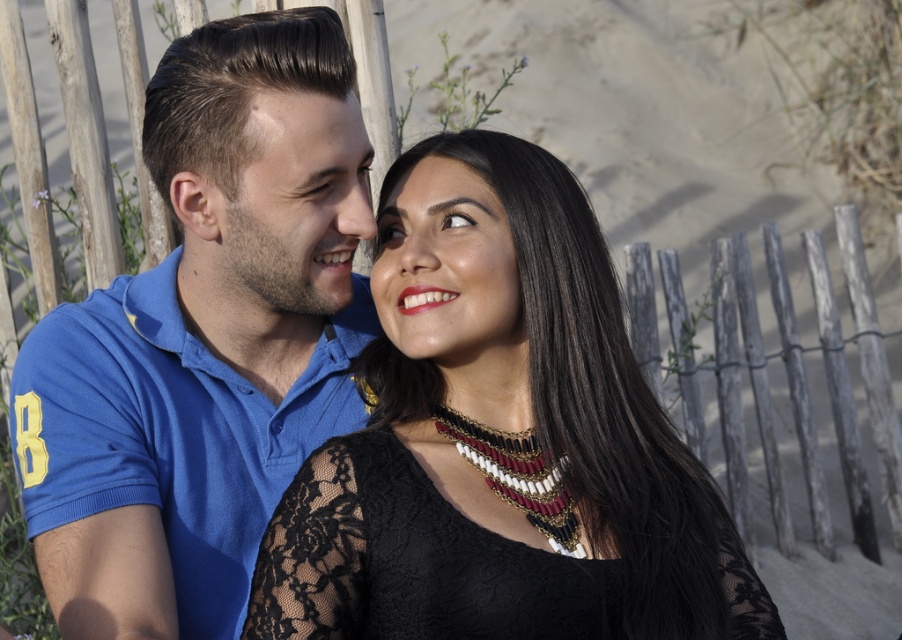
Question: Does black lace dress at center have a greater width compared to smooth skin at upper center?

Choices:
 (A) yes
 (B) no

Answer: (A)

Question: Which of the following is the farthest from the observer?

Choices:
 (A) blue cotton polo shirt at left
 (B) smooth skin at upper center

Answer: (B)

Question: Can you confirm if black lace dress at center is positioned below smooth skin at upper center?

Choices:
 (A) yes
 (B) no

Answer: (A)

Question: Which is farther from the matte black hair at upper center?

Choices:
 (A) black lace dress at center
 (B) smooth skin at upper center
 (C) blue cotton polo shirt at left

Answer: (A)

Question: Considering the relative positions of blue cotton polo shirt at left and matte black hair at upper center in the image provided, where is blue cotton polo shirt at left located with respect to matte black hair at upper center?

Choices:
 (A) right
 (B) left

Answer: (B)

Question: Which object appears closest to the camera in this image?

Choices:
 (A) smooth skin at upper center
 (B) black lace dress at center

Answer: (B)